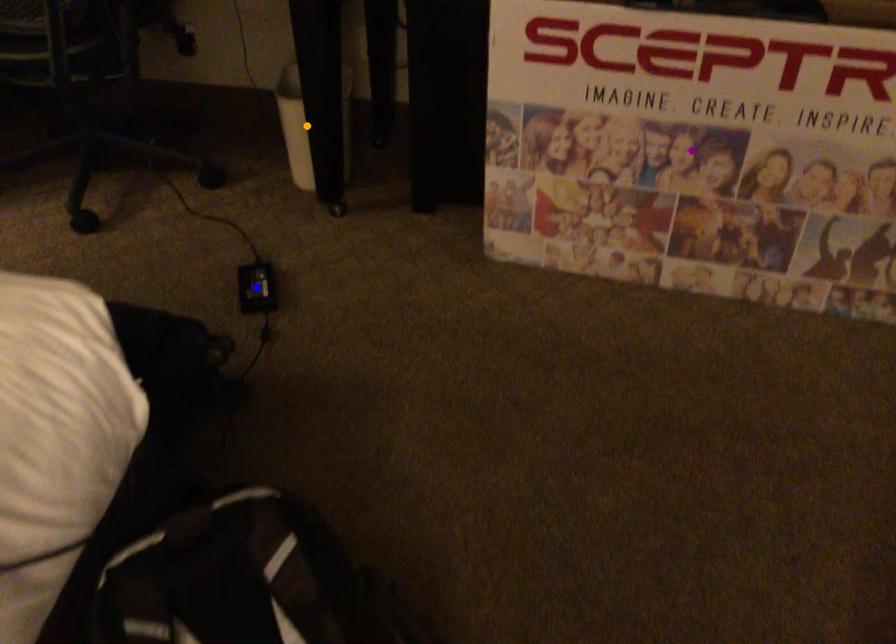
Order these from nearest to farthest:
A) orange point
B) purple point
C) blue point

purple point < blue point < orange point